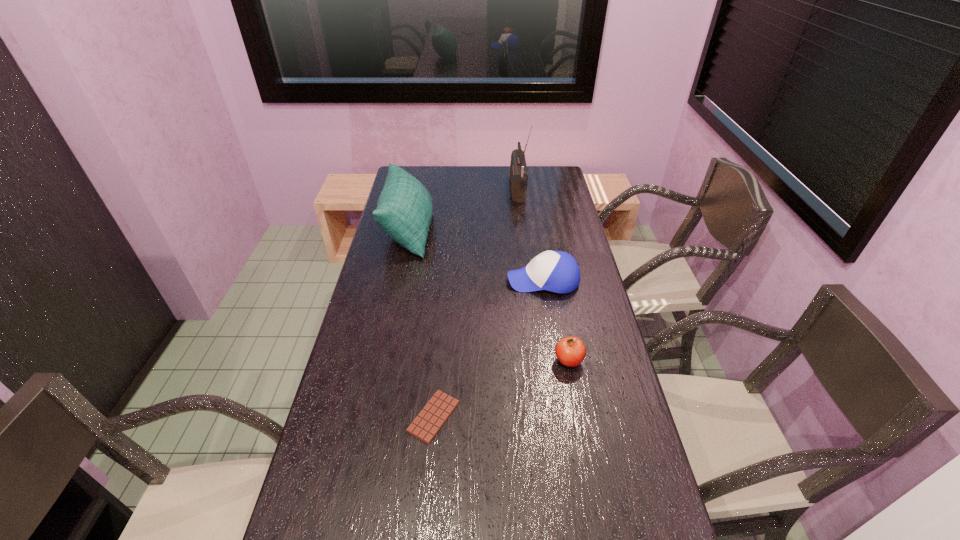
Find the location of `vacant space that is in between the second farthest object and the second nearest object`. vacant space that is in between the second farthest object and the second nearest object is located at coordinates (489, 296).

Where is `empty space between the baseball cap and the nearest object`? Image resolution: width=960 pixels, height=540 pixels. empty space between the baseball cap and the nearest object is located at coordinates (489, 348).

This screenshot has height=540, width=960. In order to click on vacant region between the cushion and the baseball cap in this screenshot , I will do [476, 255].

Image resolution: width=960 pixels, height=540 pixels. Identify the location of free space between the shortest object and the baseball cap. point(489,348).

At what (x,y) coordinates should I click in order to perform the action: click on object that is the fourth closest to the farthest object. Please return your answer as a coordinate pair (x, y). Looking at the image, I should click on (426, 425).

Identify which object is located as the fourth nearest to the tallest object. Please provide its 2D coordinates. Your answer should be formatted as a tuple, i.e. [(x, y)], where the tuple contains the x and y coordinates of a point satisfying the conditions above.

[(426, 425)]

At what (x,y) coordinates should I click in order to perform the action: click on free region that satisfies the following two spatial constraints: 1. on the back side of the fourth farthest object; 2. on the front-facing side of the tallest object. Please return your answer as a coordinate pair (x, y). Looking at the image, I should click on (536, 190).

Where is `vacant space that satisfies the following two spatial constraints: 1. on the front-facing side of the fourth farthest object; 2. on the left side of the cushion`? vacant space that satisfies the following two spatial constraints: 1. on the front-facing side of the fourth farthest object; 2. on the left side of the cushion is located at coordinates (381, 361).

At what (x,y) coordinates should I click in order to perform the action: click on vacant space that satisfies the following two spatial constraints: 1. on the back side of the fourth farthest object; 2. on the front-facing side of the radio receiver. Please return your answer as a coordinate pair (x, y). The image size is (960, 540). Looking at the image, I should click on (536, 190).

Image resolution: width=960 pixels, height=540 pixels. Identify the location of vacant space that satisfies the following two spatial constraints: 1. on the front-facing side of the candy bar; 2. on the right side of the second farthest object. (370, 416).